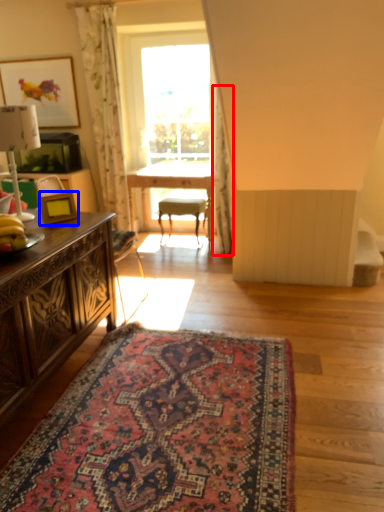
Question: Which object is further to the camera taking this photo, curtain (highlighted by a red box) or picture frame (highlighted by a blue box)?

Choices:
 (A) curtain
 (B) picture frame

Answer: (A)